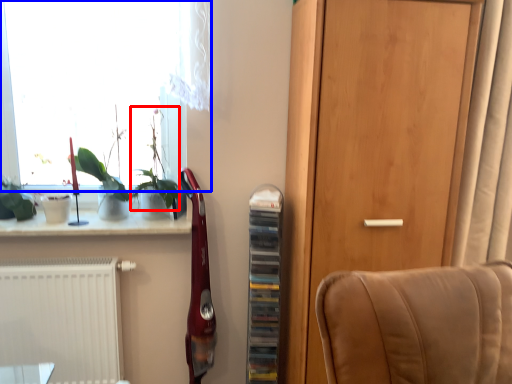
Question: Which object appears closest to the camera in this image, plant (highlighted by a red box) or window (highlighted by a blue box)?

Choices:
 (A) plant
 (B) window

Answer: (A)